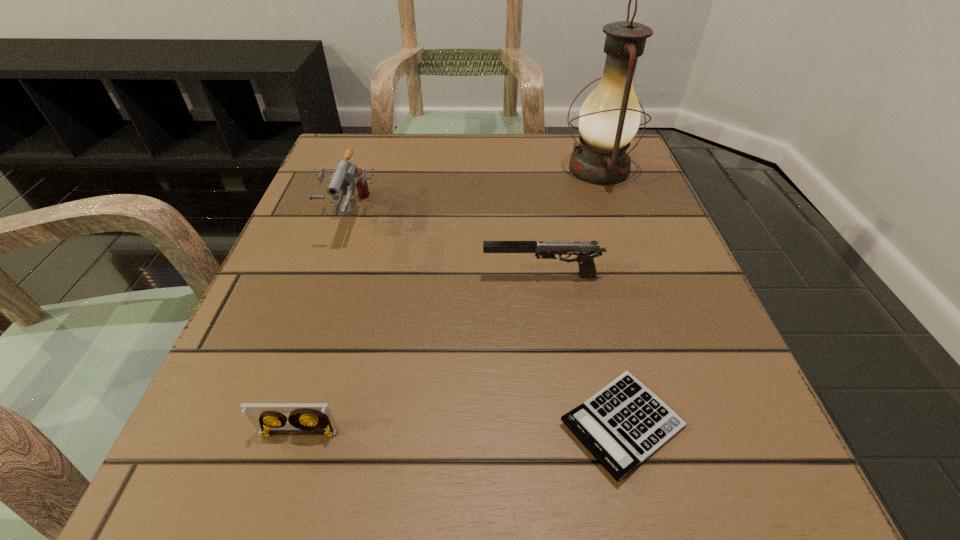
Where is `free space in the image that satisfies the following two spatial constraints: 1. at the barrel end of the calculator; 2. on the right side of the fourth shortest object`? free space in the image that satisfies the following two spatial constraints: 1. at the barrel end of the calculator; 2. on the right side of the fourth shortest object is located at coordinates (278, 424).

Find the location of a particular element. free location that satisfies the following two spatial constraints: 1. at the muzzle end of the shortest object; 2. on the right side of the nearer gun is located at coordinates (563, 424).